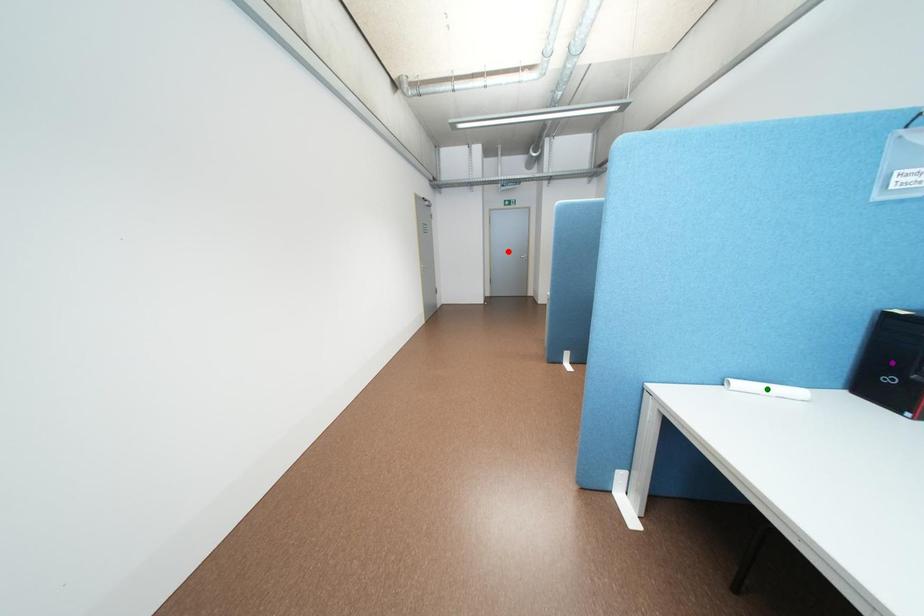
Order these from nearest to farthest:
red point
green point
purple point

purple point
green point
red point